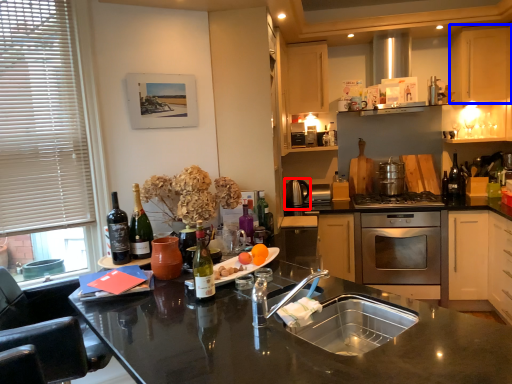
Question: Which point is closer to the camera, appliance (highlighted by a red box) or cabinetry (highlighted by a blue box)?

Choices:
 (A) appliance
 (B) cabinetry

Answer: (B)